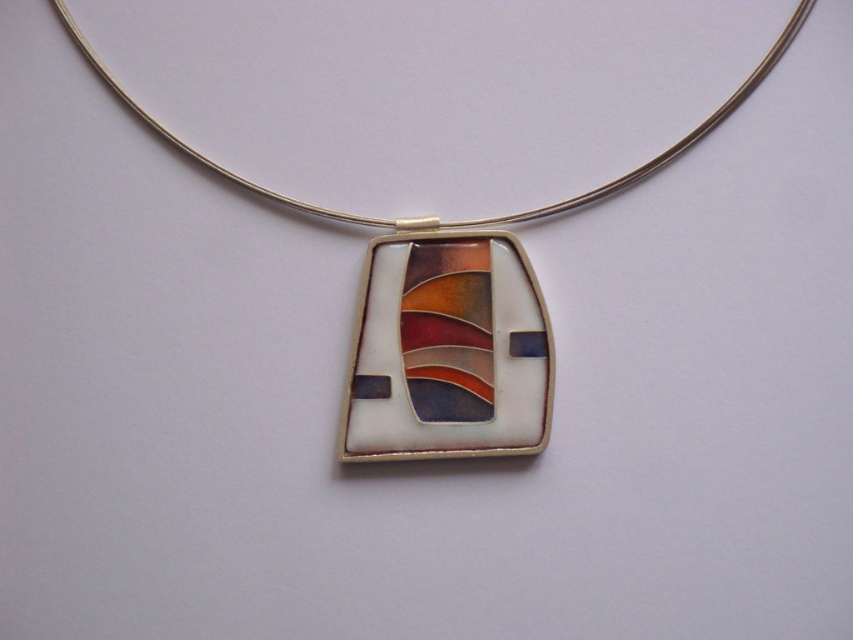
Question: Is matte silver pendant at center further to the viewer compared to matte glass pendant at center?

Choices:
 (A) yes
 (B) no

Answer: (B)

Question: Does matte silver pendant at center appear under matte glass pendant at center?

Choices:
 (A) yes
 (B) no

Answer: (B)

Question: Among these points, which one is nearest to the camera?

Choices:
 (A) (538, 298)
 (B) (473, 355)

Answer: (A)

Question: Which of the following is the farthest from the observer?

Choices:
 (A) matte glass pendant at center
 (B) matte silver pendant at center

Answer: (A)

Question: Which point is farther from the camera taking this photo?

Choices:
 (A) (749, 74)
 (B) (421, 419)

Answer: (B)

Question: Is matte silver pendant at center to the right of matte glass pendant at center from the viewer's perspective?

Choices:
 (A) yes
 (B) no

Answer: (B)